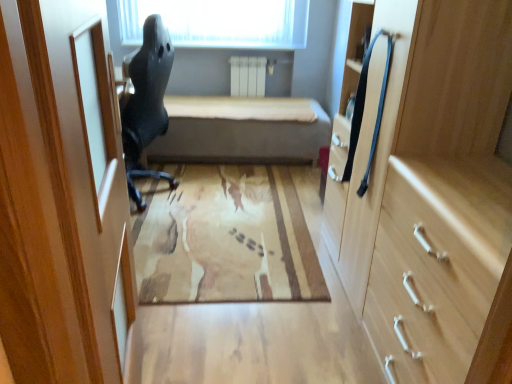
The image size is (512, 384). What do you see at coordinates (437, 264) in the screenshot?
I see `light wood drawer at right` at bounding box center [437, 264].

Identify the location of wooden door at left. (62, 196).

Find the location of `matte black chair at left`. matte black chair at left is located at coordinates (146, 102).

Identify the location of light wood drawer at right. (437, 264).

Which object is more forward, matte black chair at left or wooden door at left?

wooden door at left.

Measure the distance from matte black chair at left to wooden door at left.

matte black chair at left is 5.07 feet from wooden door at left.

Does matte black chair at left have a greater height compared to wooden door at left?

No.

Where is `chair that appears behind the wooden door at left`? chair that appears behind the wooden door at left is located at coordinates (146, 102).

At what (x,y) coordinates should I click in order to perform the action: click on drawer behind the wooden door at left. Please return your answer as a coordinate pair (x, y). The image size is (512, 384). Looking at the image, I should click on (437, 264).

Considering the relative positions of wooden door at left and light wood drawer at right in the image provided, is wooden door at left to the left of light wood drawer at right from the viewer's perspective?

Yes.

Based on their sizes in the image, would you say wooden door at left is bigger or smaller than light wood drawer at right?

wooden door at left is smaller than light wood drawer at right.

From the image's perspective, is wooden door at left located above or below light wood drawer at right?

Clearly, from the image's perspective, wooden door at left is above light wood drawer at right.

Find the location of `drawer on the right of wooden door at left`. drawer on the right of wooden door at left is located at coordinates (437, 264).

How far apart are light wood drawer at right and wooden door at left?

light wood drawer at right is 35.82 inches away from wooden door at left.

From the image's perspective, is light wood drawer at right over wooden door at left?

Actually, light wood drawer at right appears below wooden door at left in the image.

Which of these two, light wood drawer at right or wooden door at left, is smaller?

Smaller between the two is wooden door at left.

Is light wood cabinet at right to the right of wooden door at left from the viewer's perspective?

Yes, light wood cabinet at right is to the right of wooden door at left.

Is light wood cabinet at right looking in the opposite direction of wooden door at left?

No, wooden door at left is not at the back of light wood cabinet at right.

You are a GUI agent. You are given a task and a screenshot of the screen. Output one action in this format:
    pyautogui.click(x=<x>, y=<y>)
    Task: Click on the cabinetry on the right of wooden door at left
    
    Given the screenshot: What is the action you would take?
    pyautogui.click(x=426, y=186)

Can you tell me how much light wood cabinet at right and wooden door at left differ in facing direction?

174 degrees.

From the image's perspective, is beige fabric bed at center above or below wooden door at left?

From the image's perspective, beige fabric bed at center appears above wooden door at left.

Based on the photo, can you confirm if beige fabric bed at center is smaller than wooden door at left?

Actually, beige fabric bed at center might be larger than wooden door at left.

In the image, is beige fabric bed at center on the left side or the right side of wooden door at left?

beige fabric bed at center is positioned on wooden door at left's right side.

Based on the photo, which is more to the right, light wood cabinet at right or matte black chair at left?

From the viewer's perspective, light wood cabinet at right appears more on the right side.

From a real-world perspective, who is located lower, light wood cabinet at right or matte black chair at left?

In real-world perspective, matte black chair at left is lower.

Is light wood cabinet at right oriented away from matte black chair at left?

No, light wood cabinet at right is not facing away from matte black chair at left.

Considering their positions, is light wood cabinet at right located in front of or behind matte black chair at left?

Clearly, light wood cabinet at right is in front of matte black chair at left.

From a real-world perspective, is matte black chair at left over light wood cabinet at right?

No.

Is matte black chair at left spatially inside light wood cabinet at right, or outside of it?

The correct answer is: outside.

Which object is positioned more to the right, matte black chair at left or light wood cabinet at right?

From the viewer's perspective, light wood cabinet at right appears more on the right side.

Where is `chair on the left of wooden door at left`? This screenshot has height=384, width=512. chair on the left of wooden door at left is located at coordinates (146, 102).

Find the location of a particular element. This screenshot has height=384, width=512. door that is above the light wood drawer at right (from a real-world perspective) is located at coordinates (62, 196).

Considering their positions, is beige fabric bed at center positioned closer to light wood cabinet at right than wooden door at left?

The object closer to light wood cabinet at right is wooden door at left.

From the image, which object appears to be nearer to light wood drawer at right, beige fabric bed at center or light wood cabinet at right?

Among the two, light wood cabinet at right is located nearer to light wood drawer at right.

Looking at the image, which one is located further to light wood cabinet at right, beige fabric bed at center or matte black chair at left?

beige fabric bed at center is positioned further to the anchor light wood cabinet at right.

Consider the image. Estimate the real-world distances between objects in this image. Which object is further from light wood drawer at right, light wood cabinet at right or wooden door at left?

wooden door at left is positioned further to the anchor light wood drawer at right.

Based on their spatial positions, is light wood cabinet at right or light wood drawer at right closer to matte black chair at left?

light wood cabinet at right.

Based on their spatial positions, is light wood drawer at right or matte black chair at left closer to light wood cabinet at right?

light wood drawer at right lies closer to light wood cabinet at right than the other object.

From the image, which object appears to be farther from wooden door at left, light wood drawer at right or beige fabric bed at center?

beige fabric bed at center lies further to wooden door at left than the other object.

From the picture: Estimate the real-world distances between objects in this image. Which object is further from beige fabric bed at center, light wood cabinet at right or matte black chair at left?

The object further to beige fabric bed at center is light wood cabinet at right.

Locate an element on the screen. chair located between light wood cabinet at right and beige fabric bed at center in the depth direction is located at coordinates (146, 102).

Where is `drawer between wooden door at left and beige fabric bed at center from front to back`? drawer between wooden door at left and beige fabric bed at center from front to back is located at coordinates (437, 264).

At what (x,y) coordinates should I click in order to perform the action: click on chair between light wood drawer at right and beige fabric bed at center from front to back. Please return your answer as a coordinate pair (x, y). Looking at the image, I should click on (146, 102).

Where is `cabinetry positioned between wooden door at left and beige fabric bed at center from near to far`? The width and height of the screenshot is (512, 384). cabinetry positioned between wooden door at left and beige fabric bed at center from near to far is located at coordinates (426, 186).